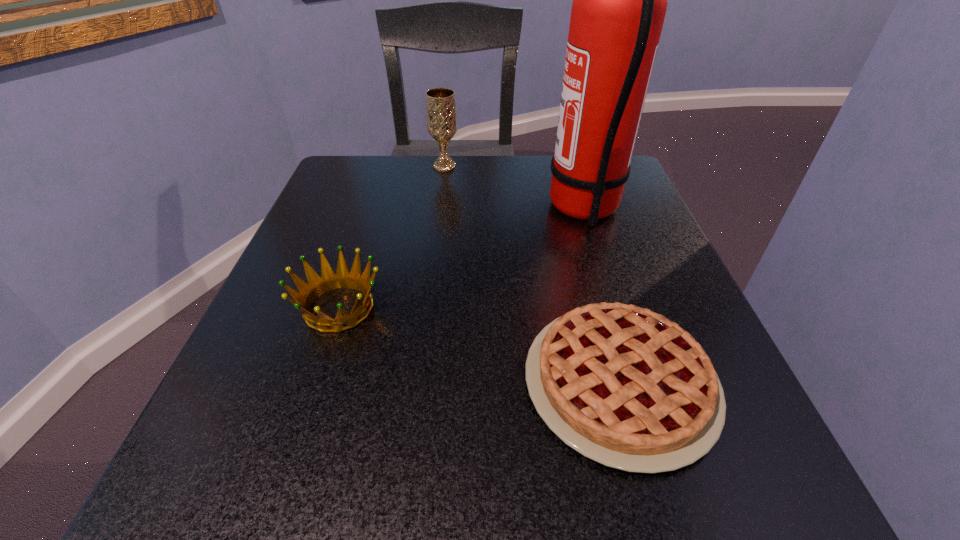
The width and height of the screenshot is (960, 540). I want to click on vacant area situated 0.300m on the right of the third shortest object, so click(585, 166).

The height and width of the screenshot is (540, 960). I want to click on free location located 0.260m on the back of the second shortest object, so click(x=375, y=197).

Locate an element on the screen. The image size is (960, 540). free space located 0.260m on the back of the shortest object is located at coordinates (574, 219).

Where is `fire extinguisher at the far edge`? Image resolution: width=960 pixels, height=540 pixels. fire extinguisher at the far edge is located at coordinates click(619, 5).

You are a GUI agent. You are given a task and a screenshot of the screen. Output one action in this format:
    pyautogui.click(x=<x>, y=<y>)
    Task: Click on the chalice at the far edge
    
    Given the screenshot: What is the action you would take?
    pyautogui.click(x=440, y=102)

This screenshot has height=540, width=960. I want to click on object present at the near edge, so click(626, 387).

Where is `object that is at the left edge`? This screenshot has height=540, width=960. object that is at the left edge is located at coordinates coord(329,280).

This screenshot has width=960, height=540. I want to click on fire extinguisher that is positioned at the right edge, so click(619, 5).

The height and width of the screenshot is (540, 960). In order to click on pie present at the right edge in this screenshot , I will do (x=626, y=387).

Identify the location of object that is at the far right corner. Image resolution: width=960 pixels, height=540 pixels. (619, 5).